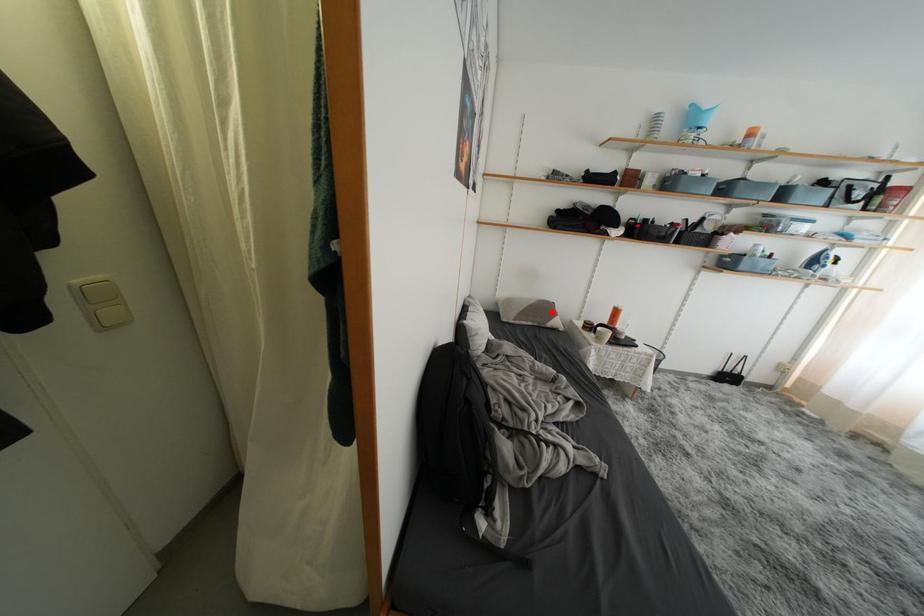
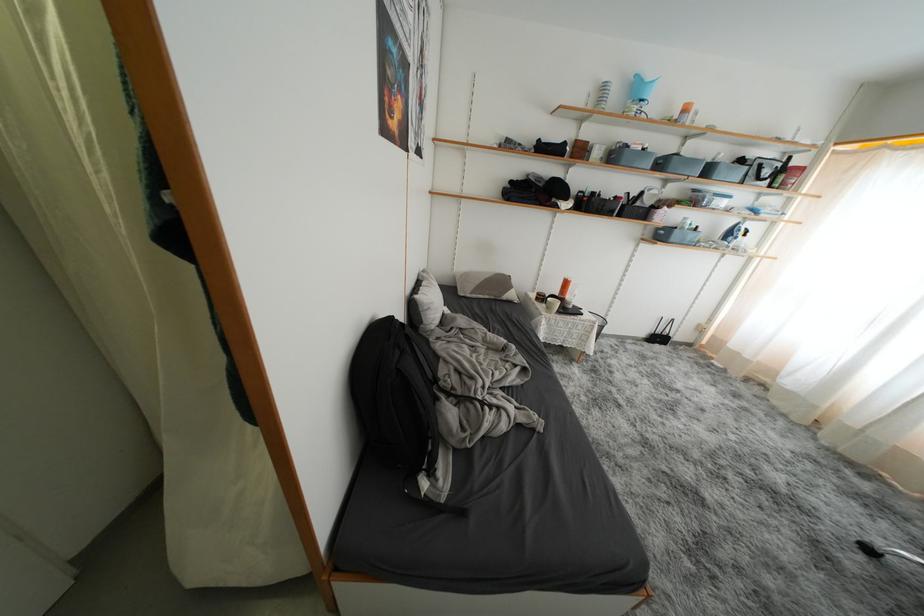
Locate, in the second image, the point that corresponds to the highlighted location in the first image.

(508, 286)